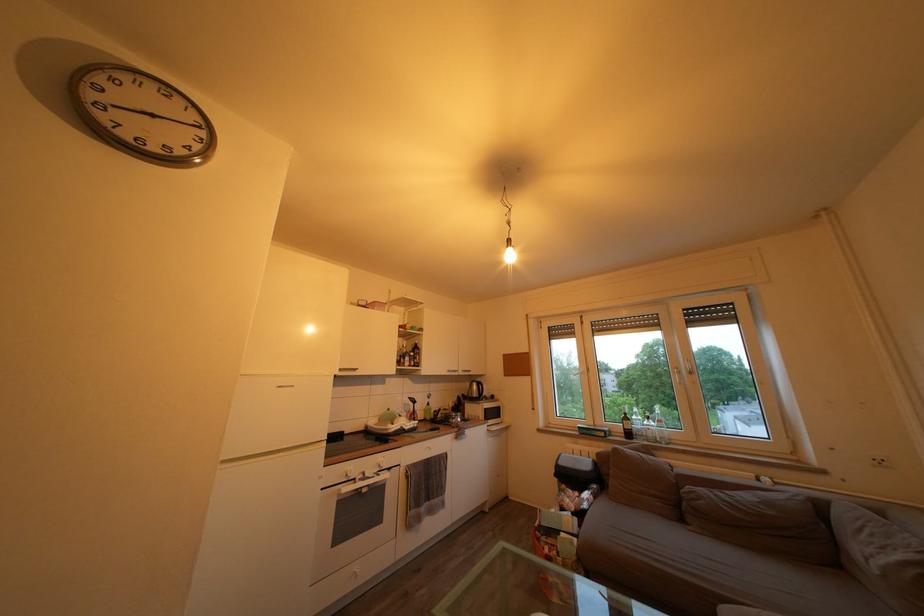
The location [475,390] corresponds to which object?

It refers to a black electric kettle.